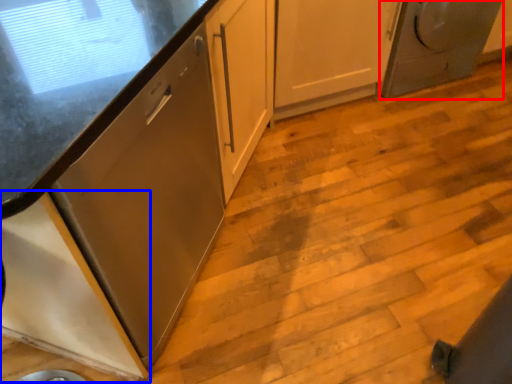
Question: Which of the following is the farthest to the observer, home appliance (highlighted by a red box) or cabinetry (highlighted by a blue box)?

Choices:
 (A) home appliance
 (B) cabinetry

Answer: (A)